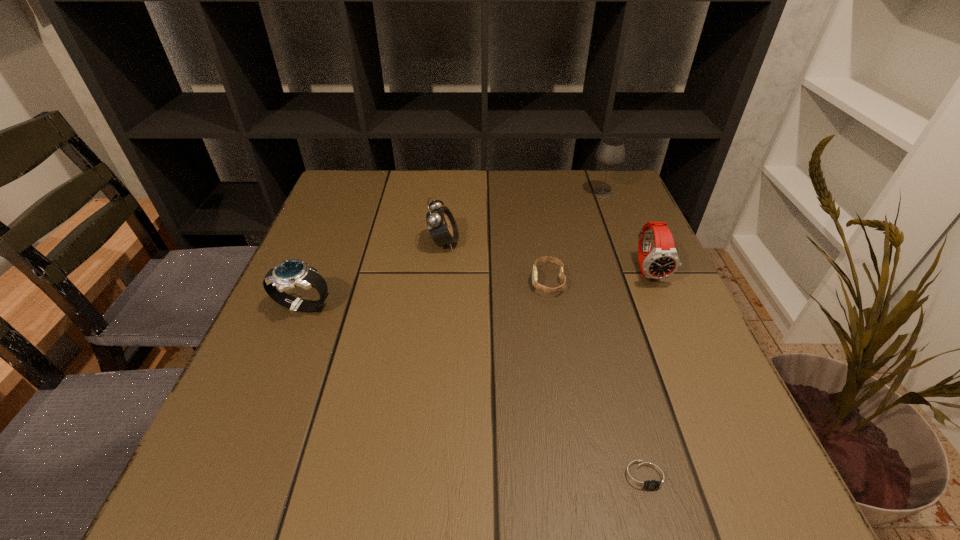
You are a GUI agent. You are given a task and a screenshot of the screen. Output one action in this format:
    pyautogui.click(x=<x>, y=<y>)
    Task: Click on the vacant area between the second shortest object and the leftmost object
    This screenshot has height=540, width=960.
    Given the screenshot: What is the action you would take?
    pyautogui.click(x=425, y=294)

At what (x,y) coordinates should I click in order to perform the action: click on free space between the third watch from right to left and the second tallest watch. Please return your answer as a coordinate pair (x, y). The height and width of the screenshot is (540, 960). Looking at the image, I should click on (425, 294).

Image resolution: width=960 pixels, height=540 pixels. In order to click on vacant point located between the fifth tallest object and the rightmost watch in this screenshot , I will do `click(598, 276)`.

At what (x,y) coordinates should I click in order to perform the action: click on free space between the fourth tallest object and the third watch from right to left. Please return your answer as a coordinate pair (x, y). Image resolution: width=960 pixels, height=540 pixels. Looking at the image, I should click on (425, 294).

You are a GUI agent. You are given a task and a screenshot of the screen. Output one action in this format:
    pyautogui.click(x=<x>, y=<y>)
    Task: Click on the unoccupied position between the second watch from right to left and the leftmost watch
    
    Given the screenshot: What is the action you would take?
    pyautogui.click(x=475, y=392)

Where is `blank region between the alarm clock and the second tallest watch`? The image size is (960, 540). blank region between the alarm clock and the second tallest watch is located at coordinates (373, 275).

You are a GUI agent. You are given a task and a screenshot of the screen. Output one action in this format:
    pyautogui.click(x=<x>, y=<y>)
    Task: Click on the free space between the alarm clock and the third watch from right to left
    
    Given the screenshot: What is the action you would take?
    (496, 262)

Image resolution: width=960 pixels, height=540 pixels. I want to click on empty space that is in between the second shortest object and the rightmost watch, so click(598, 276).

The image size is (960, 540). I want to click on the fourth closest object to the rightmost watch, so click(441, 224).

Locate an element on the screen. The image size is (960, 540). object that can be found as the second closest to the third watch from right to left is located at coordinates (441, 224).